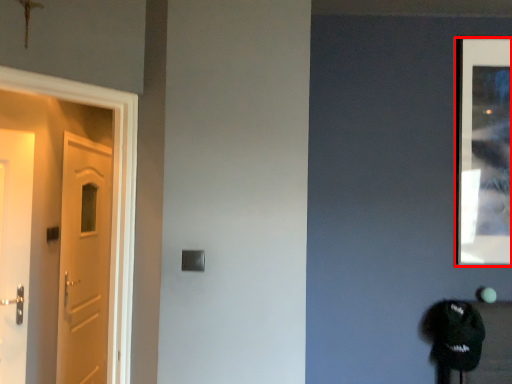
Question: Observing the image, what is the correct spatial positioning of picture frame (annotated by the red box) in reference to door?

Choices:
 (A) right
 (B) left

Answer: (A)